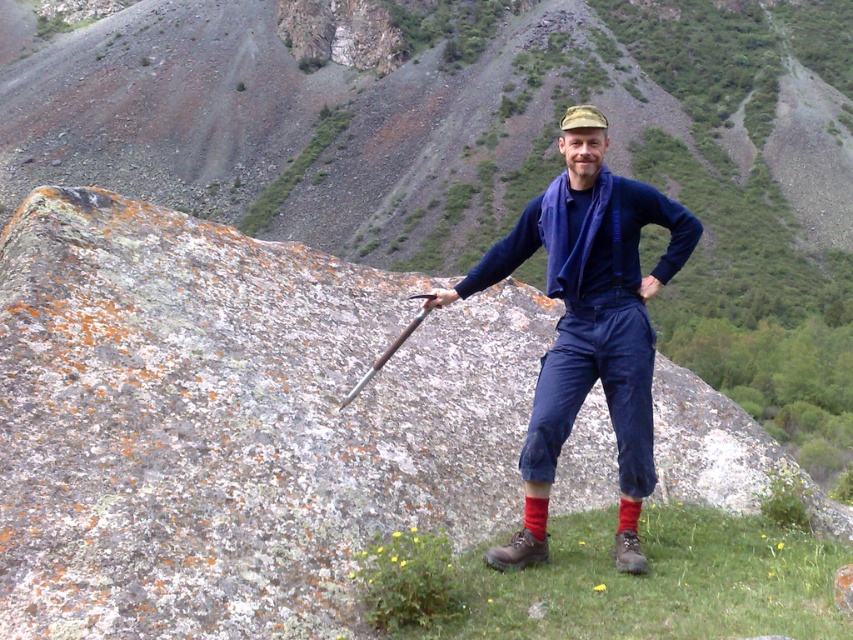
You are an observer looking at the scene. Which object is located to the right of the other between the blue fabric shirt at center and the brown suede boot at lower right?

The blue fabric shirt at center is positioned on the right side of brown suede boot at lower right.

You are navigating a rocky terrain and need to move from point A to point B. The coordinates for point A are point [570,136] and point B are point [489,550]. Which point is closer to you as you start your journey?

Point A is closer to you since it is further to the viewer than point B.

You are a photographer trying to capture the person in the image. You want to focus on the blue fabric shirt at center and the brown leather boot at lower center. Which object should you adjust your camera focus on first if you want to ensure both are in focus?

The blue fabric shirt at center is further to the viewer than the brown leather boot at lower center, so you should focus on the blue fabric shirt at center first to ensure both are in focus.